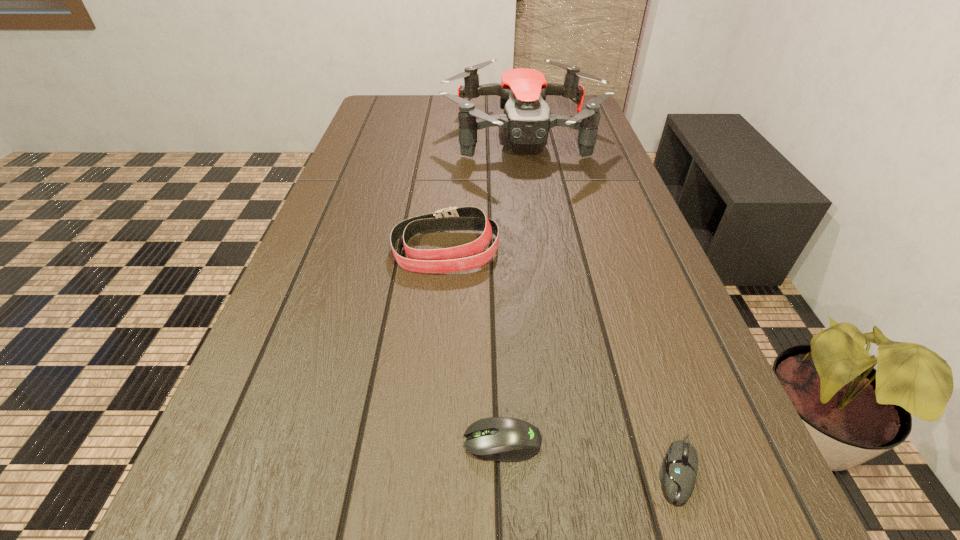
Where is `vacant space positioned on the wheel side of the taller computer mouse`? Image resolution: width=960 pixels, height=540 pixels. vacant space positioned on the wheel side of the taller computer mouse is located at coordinates (230, 442).

Image resolution: width=960 pixels, height=540 pixels. What are the coordinates of `vacant space situated 0.240m on the wheel side of the taller computer mouse` in the screenshot? It's located at (299, 442).

The width and height of the screenshot is (960, 540). Identify the location of free space located on the wheel side of the taller computer mouse. (388, 442).

Find the location of `free space located on the back of the shortest object`. free space located on the back of the shortest object is located at coordinates (643, 363).

Image resolution: width=960 pixels, height=540 pixels. In order to click on object at the far edge in this screenshot , I will do `click(526, 120)`.

You are a GUI agent. You are given a task and a screenshot of the screen. Output one action in this format:
    pyautogui.click(x=<x>, y=<y>)
    Task: Click on the drone situated at the right edge
    This screenshot has width=960, height=540.
    Given the screenshot: What is the action you would take?
    pyautogui.click(x=526, y=120)

Find the location of a particular element. computer mouse that is at the right edge is located at coordinates [x=678, y=472].

At what (x,y) coordinates should I click in order to perform the action: click on object at the far right corner. Please return your answer as a coordinate pair (x, y). Looking at the image, I should click on (526, 120).

Identify the location of free space at the left edge of the desktop. The image size is (960, 540). (333, 215).

Where is `vacant space at the right edge`? Image resolution: width=960 pixels, height=540 pixels. vacant space at the right edge is located at coordinates (722, 530).